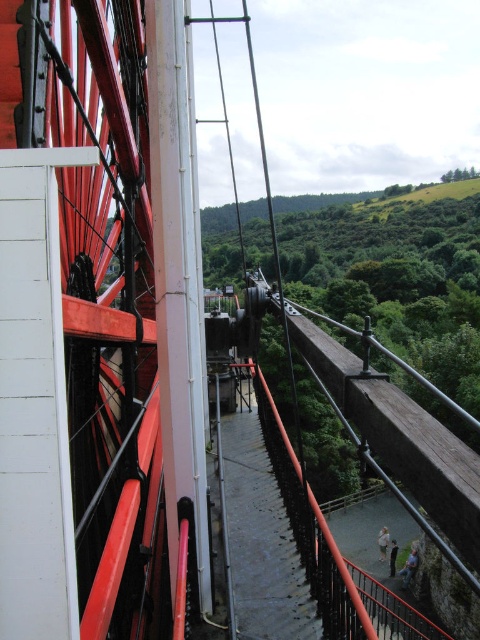
Is light brown leather jacket at center positioned at the back of dark gray fabric at lower center?

No, it is not.

Between light brown leather jacket at center and dark gray fabric at lower center, which one has more height?

light brown leather jacket at center

Find the location of `light brown leather jacket at center`. light brown leather jacket at center is located at coordinates (409, 566).

At what (x,y) coordinates should I click in order to perform the action: click on light brown leather jacket at center. Please return your answer as a coordinate pair (x, y). Looking at the image, I should click on (409, 566).

Can you confirm if light beige fabric at lower center is positioned to the left of dark gray fabric at lower center?

No, light beige fabric at lower center is not to the left of dark gray fabric at lower center.

Who is more distant from viewer, [387,538] or [397,547]?

The point [387,538] is behind.

Find the location of `light beige fabric at lower center`. light beige fabric at lower center is located at coordinates (383, 541).

Is light brown leather jacket at center shorter than light beige fabric at lower center?

Incorrect, light brown leather jacket at center's height does not fall short of light beige fabric at lower center's.

Is light brown leather jacket at center in front of light beige fabric at lower center?

Yes, light brown leather jacket at center is closer to the viewer.

Is point (403, 572) more distant than point (384, 531)?

No, (403, 572) is closer to viewer.

At what (x,y) coordinates should I click in order to perform the action: click on light brown leather jacket at center. Please return your answer as a coordinate pair (x, y). Looking at the image, I should click on (409, 566).